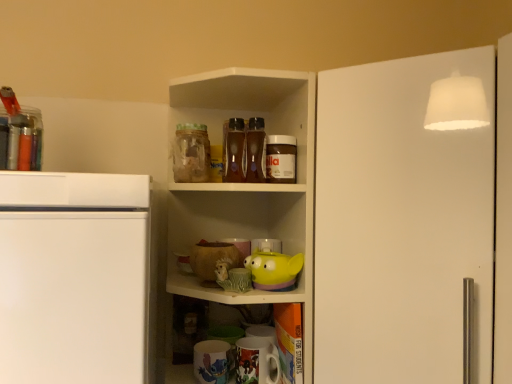
Image resolution: width=512 pixels, height=384 pixels. What do you see at coordinates (191, 153) in the screenshot?
I see `transparent glass jar at upper center, which appears as the 1th beverage when viewed from the left` at bounding box center [191, 153].

You are a GUI agent. You are given a task and a screenshot of the screen. Output one action in this format:
    pyautogui.click(x=<x>, y=<y>)
    Task: Click on the matte green ceramic mug at center, positioned as the first toy in left-to-right order
    The image size is (512, 384).
    Given the screenshot: What is the action you would take?
    pyautogui.click(x=232, y=277)

What do you see at coordinates (232, 277) in the screenshot? I see `matte green ceramic mug at center, positioned as the 2th toy in right-to-left order` at bounding box center [232, 277].

The height and width of the screenshot is (384, 512). I want to click on white matte door at upper right, so click(401, 225).

In the scene shown: Between matte ceramic mug at lower center, which is the 1th appliance from left to right, and matte plastic shelf at center, which one appears on the left side from the viewer's perspective?

matte ceramic mug at lower center, which is the 1th appliance from left to right, is more to the left.

From their relative heights in the image, would you say matte ceramic mug at lower center, arranged as the second appliance when viewed from the right, is taller or shorter than matte plastic shelf at center?

Considering their sizes, matte ceramic mug at lower center, arranged as the second appliance when viewed from the right, has less height than matte plastic shelf at center.

Is matte ceramic mug at lower center, arranged as the second appliance when viewed from the right, wider or thinner than matte plastic shelf at center?

Considering their sizes, matte ceramic mug at lower center, arranged as the second appliance when viewed from the right, looks slimmer than matte plastic shelf at center.

Would you say matte ceramic mug at lower center, arranged as the second appliance when viewed from the right, is outside matte plastic shelf at center?

No, matte ceramic mug at lower center, arranged as the second appliance when viewed from the right, is not entirely external to matte plastic shelf at center.

Between white matte door at upper right and matte green ceramic mug at center, positioned as the 2th toy in right-to-left order, which one has more height?

white matte door at upper right is taller.

Between point (456, 147) and point (247, 285), which one is positioned in front?

The point (456, 147) is closer to the camera.

What's the angular difference between white matte door at upper right and matte green ceramic mug at center, positioned as the 2th toy in right-to-left order,'s facing directions?

47.9 degrees separate the facing orientations of white matte door at upper right and matte green ceramic mug at center, positioned as the 2th toy in right-to-left order.

Between white matte door at upper right and matte green ceramic mug at center, positioned as the first toy in left-to-right order, which one has larger width?

white matte door at upper right is wider.

Is matte plastic shelf at center wider than yellow rubber duck at center, arranged as the 2th toy when viewed from the left?

Indeed, matte plastic shelf at center has a greater width compared to yellow rubber duck at center, arranged as the 2th toy when viewed from the left.

From the image's perspective, is matte plastic shelf at center on top of yellow rubber duck at center, arranged as the 2th toy when viewed from the left?

Yes, from the image's perspective, matte plastic shelf at center is above yellow rubber duck at center, arranged as the 2th toy when viewed from the left.

Considering the relative positions of matte plastic shelf at center and yellow rubber duck at center, arranged as the 2th toy when viewed from the left, in the image provided, is matte plastic shelf at center to the left of yellow rubber duck at center, arranged as the 2th toy when viewed from the left, from the viewer's perspective?

Indeed, matte plastic shelf at center is positioned on the left side of yellow rubber duck at center, arranged as the 2th toy when viewed from the left.

Which is closer to the camera, (307, 275) or (263, 272)?

The point (307, 275) is more forward.

Which is in front, point (216, 357) or point (286, 275)?

The point (286, 275) is closer to the camera.

Is matte ceramic mug at lower center, arranged as the second appliance when viewed from the right, not near yellow rubber duck at center, the 1th toy from the right?

matte ceramic mug at lower center, arranged as the second appliance when viewed from the right, is actually quite close to yellow rubber duck at center, the 1th toy from the right.

From a real-world perspective, is matte ceramic mug at lower center, arranged as the second appliance when viewed from the right, positioned under yellow rubber duck at center, the 1th toy from the right, based on gravity?

Correct, in the physical world, matte ceramic mug at lower center, arranged as the second appliance when viewed from the right, is lower than yellow rubber duck at center, the 1th toy from the right.

Is matte ceramic mug at lower center, arranged as the second appliance when viewed from the right, facing towards yellow rubber duck at center, the 1th toy from the right?

No, matte ceramic mug at lower center, arranged as the second appliance when viewed from the right, is not turned towards yellow rubber duck at center, the 1th toy from the right.

What's the angular difference between smooth chocolate spread at upper center, the first beverage viewed from the right, and matte plastic shelf at center's facing directions?

They differ by 1.38 degrees in their facing directions.

Is point (295, 158) farther from viewer compared to point (206, 82)?

No, it is not.

Between smooth chocolate spread at upper center, the first beverage viewed from the right, and matte plastic shelf at center, which one appears on the right side from the viewer's perspective?

smooth chocolate spread at upper center, the first beverage viewed from the right, is more to the right.

Considering the sizes of objects smooth chocolate spread at upper center, the first beverage viewed from the right, and matte plastic shelf at center in the image provided, who is bigger, smooth chocolate spread at upper center, the first beverage viewed from the right, or matte plastic shelf at center?

matte plastic shelf at center is bigger.

Between white matte door at upper right and matte ceramic mug at lower center, arranged as the second appliance when viewed from the right, which one appears on the right side from the viewer's perspective?

From the viewer's perspective, white matte door at upper right appears more on the right side.

Can you tell me how much white matte door at upper right and matte ceramic mug at lower center, arranged as the second appliance when viewed from the right, differ in facing direction?

The angular difference between white matte door at upper right and matte ceramic mug at lower center, arranged as the second appliance when viewed from the right, is 34.9 degrees.

Is white matte door at upper right surrounding matte ceramic mug at lower center, which is the 1th appliance from left to right?

No, matte ceramic mug at lower center, which is the 1th appliance from left to right, is not surrounded by white matte door at upper right.

From a real-world perspective, is white matte door at upper right physically located above or below matte ceramic mug at lower center, arranged as the second appliance when viewed from the right?

Clearly, from a real-world perspective, white matte door at upper right is above matte ceramic mug at lower center, arranged as the second appliance when viewed from the right.

From the image's perspective, is matte ceramic mug at lower center, which is the 1th appliance from left to right, beneath matte green ceramic mug at center, positioned as the 2th toy in right-to-left order?

Indeed, from the image's perspective, matte ceramic mug at lower center, which is the 1th appliance from left to right, is shown beneath matte green ceramic mug at center, positioned as the 2th toy in right-to-left order.

From the matte green ceramic mug at center, positioned as the 2th toy in right-to-left order, count 1st appliances backward and point to it. Please provide its 2D coordinates.

[(211, 362)]

In the scene shown: Does matte ceramic mug at lower center, which is the 1th appliance from left to right, turn towards matte green ceramic mug at center, positioned as the 2th toy in right-to-left order?

No, matte ceramic mug at lower center, which is the 1th appliance from left to right, is not oriented towards matte green ceramic mug at center, positioned as the 2th toy in right-to-left order.

The image size is (512, 384). In order to click on appliance lying on the left of matte plastic shelf at center in this screenshot , I will do click(x=211, y=362).

Image resolution: width=512 pixels, height=384 pixels. I want to click on the 2nd toy below the white matte door at upper right (from the image's perspective), so click(x=232, y=277).

Based on their spatial positions, is transparent glass jar at upper center, marked as the 2th beverage in a right-to-left arrangement, or matte ceramic mug at lower center, which is the 1th appliance from left to right, further from matte ceramic mug at lower center, acting as the first appliance starting from the right?

Among the two, transparent glass jar at upper center, marked as the 2th beverage in a right-to-left arrangement, is located further to matte ceramic mug at lower center, acting as the first appliance starting from the right.

Considering their positions, is matte green ceramic mug at center, positioned as the first toy in left-to-right order, positioned further to matte ceramic mug at lower center, arranged as the second appliance when viewed from the right, than transparent glass jar at upper center, marked as the 2th beverage in a right-to-left arrangement?

transparent glass jar at upper center, marked as the 2th beverage in a right-to-left arrangement, is further to matte ceramic mug at lower center, arranged as the second appliance when viewed from the right.

Considering their positions, is transparent glass jar at upper center, marked as the 2th beverage in a right-to-left arrangement, positioned further to matte plastic shelf at center than smooth chocolate spread at upper center, the first beverage viewed from the right?

Among the two, smooth chocolate spread at upper center, the first beverage viewed from the right, is located further to matte plastic shelf at center.

Considering their positions, is smooth chocolate spread at upper center, the first beverage viewed from the right, positioned closer to transparent glass jar at upper center, which appears as the 1th beverage when viewed from the left, than matte plastic shelf at center?

matte plastic shelf at center is positioned closer to the anchor transparent glass jar at upper center, which appears as the 1th beverage when viewed from the left.

Which object lies further to the anchor point transparent glass jar at upper center, marked as the 2th beverage in a right-to-left arrangement, white matte door at upper right or matte ceramic mug at lower center, arranged as the second appliance when viewed from the right?

Among the two, matte ceramic mug at lower center, arranged as the second appliance when viewed from the right, is located further to transparent glass jar at upper center, marked as the 2th beverage in a right-to-left arrangement.

Considering their positions, is matte ceramic mug at lower center, arranged as the second appliance when viewed from the right, positioned further to matte plastic shelf at center than matte green ceramic mug at center, positioned as the 2th toy in right-to-left order?

matte ceramic mug at lower center, arranged as the second appliance when viewed from the right, is further to matte plastic shelf at center.

Considering their positions, is matte ceramic mug at lower center, acting as the first appliance starting from the right, positioned further to matte plastic shelf at center than yellow rubber duck at center, arranged as the 2th toy when viewed from the left?

matte ceramic mug at lower center, acting as the first appliance starting from the right, is further to matte plastic shelf at center.

Considering their positions, is transparent glass jar at upper center, marked as the 2th beverage in a right-to-left arrangement, positioned further to matte plastic shelf at center than matte green ceramic mug at center, positioned as the first toy in left-to-right order?

The object further to matte plastic shelf at center is matte green ceramic mug at center, positioned as the first toy in left-to-right order.

You are a GUI agent. You are given a task and a screenshot of the screen. Output one action in this format:
    pyautogui.click(x=<x>, y=<y>)
    Task: Click on the appliance between matte green ceramic mug at center, positioned as the 2th toy in right-to-left order, and matte ceramic mug at lower center, which is the 1th appliance from left to right, from top to bottom
    The image size is (512, 384).
    Given the screenshot: What is the action you would take?
    tap(256, 361)

This screenshot has width=512, height=384. I want to click on shelf between smooth chocolate spread at upper center, the first beverage viewed from the right, and matte ceramic mug at lower center, arranged as the second appliance when viewed from the right, in the vertical direction, so click(249, 183).

Where is `beverage located between matte plastic shelf at center and white matte door at upper right in the left-right direction`? This screenshot has width=512, height=384. beverage located between matte plastic shelf at center and white matte door at upper right in the left-right direction is located at coordinates (281, 159).

This screenshot has width=512, height=384. I want to click on toy between yellow rubber duck at center, the 1th toy from the right, and matte ceramic mug at lower center, which is the 1th appliance from left to right, vertically, so click(232, 277).